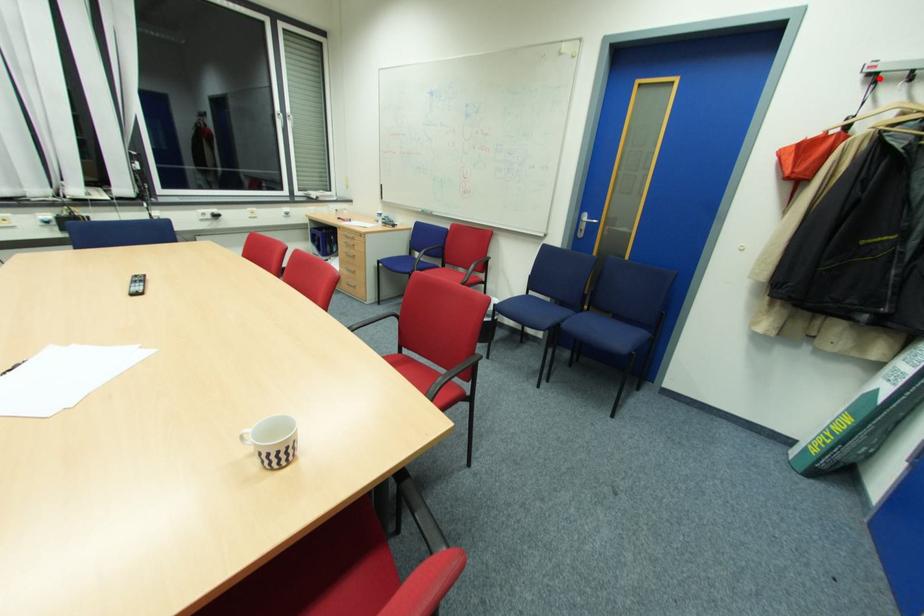
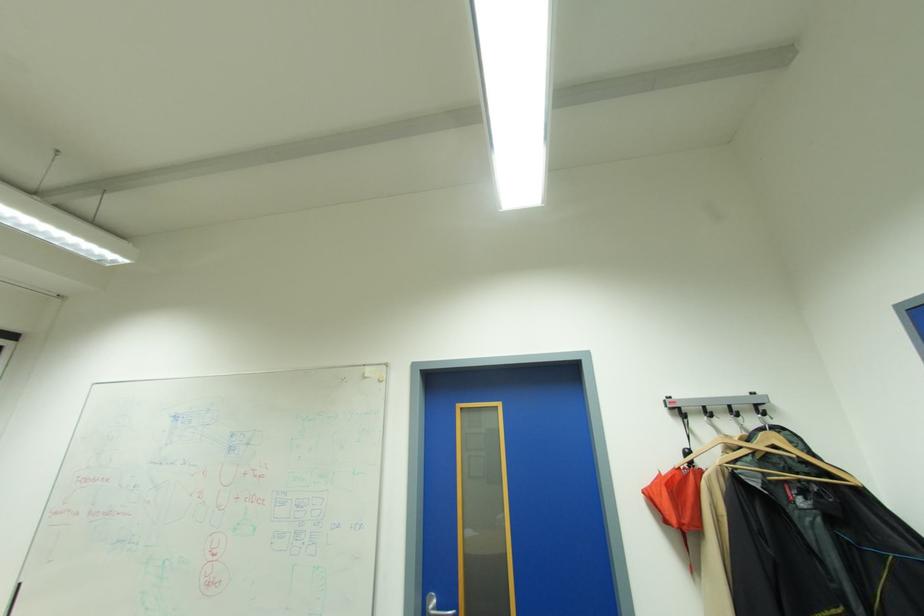
Where in the second image is the point corresponding to the highlighted location from the first image?

(683, 411)